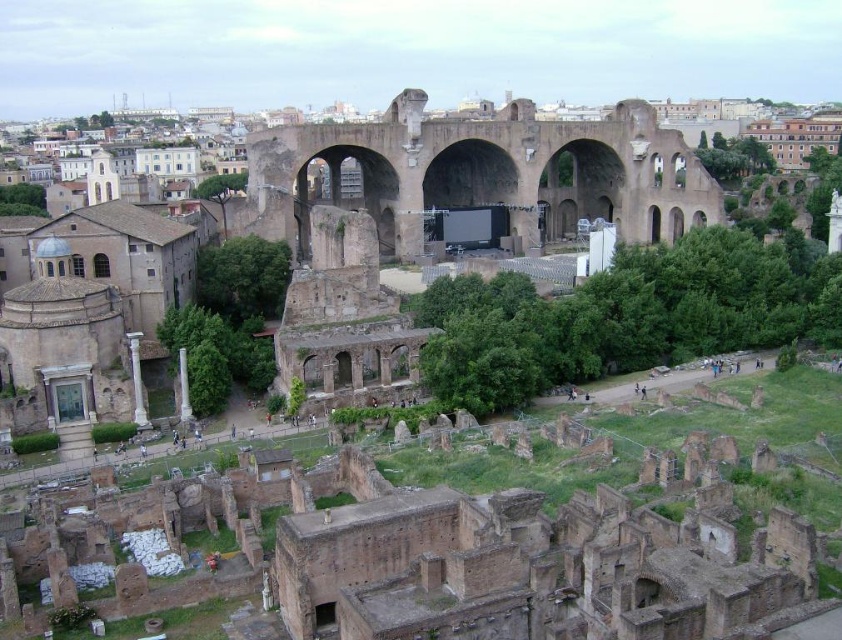
Does brown stone ruins at center have a greater width compared to white marble column at lower left?

Correct, the width of brown stone ruins at center exceeds that of white marble column at lower left.

This screenshot has height=640, width=842. What do you see at coordinates (486, 173) in the screenshot? I see `brown stone ruins at center` at bounding box center [486, 173].

At what (x,y) coordinates should I click in order to perform the action: click on brown stone ruins at center. Please return your answer as a coordinate pair (x, y). The width and height of the screenshot is (842, 640). Looking at the image, I should click on (486, 173).

The width and height of the screenshot is (842, 640). Find the location of `brown stone ruins at center`. brown stone ruins at center is located at coordinates (486, 173).

Which is below, brown stone ruins at center or white marble pillar at lower left?

white marble pillar at lower left

I want to click on brown stone ruins at center, so point(486,173).

The image size is (842, 640). I want to click on brown stone ruins at center, so click(x=486, y=173).

Between white marble column at lower left and white marble pillar at lower left, which one appears on the right side from the viewer's perspective?

From the viewer's perspective, white marble pillar at lower left appears more on the right side.

Who is more distant from viewer, (136, 369) or (180, 417)?

Point (180, 417)

The width and height of the screenshot is (842, 640). Find the location of `white marble column at lower left`. white marble column at lower left is located at coordinates (137, 380).